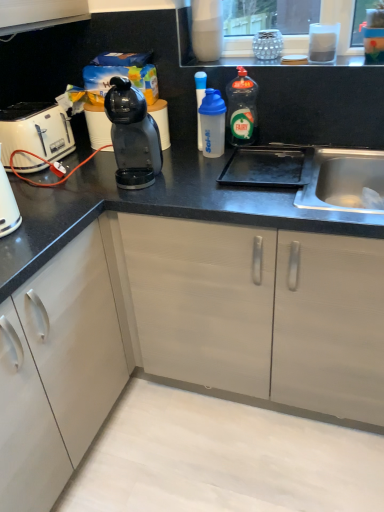
Question: Considering the positions of white plastic toaster at left and transparent plastic shaker at center, which is the first bottle in left-to-right order, in the image, is white plastic toaster at left wider or thinner than transparent plastic shaker at center, which is the first bottle in left-to-right order,?

Choices:
 (A) thin
 (B) wide

Answer: (B)

Question: Is white plastic toaster at left bigger or smaller than transparent plastic shaker at center, which is the first bottle in left-to-right order?

Choices:
 (A) small
 (B) big

Answer: (B)

Question: Which is nearer to the transparent plastic bottle at center, the first bottle from the right?

Choices:
 (A) white plastic shaker at center, the 2th bottle viewed from the right
 (B) white plastic toaster at left
 (C) transparent plastic shaker at center, which is the first bottle in left-to-right order
 (D) black plastic coffee machine at center

Answer: (A)

Question: Which of these objects is positioned farthest from the transparent plastic shaker at center, which is the first bottle in left-to-right order?

Choices:
 (A) white plastic toaster at left
 (B) white plastic shaker at center, the 2th bottle viewed from the right
 (C) black plastic coffee machine at center
 (D) transparent plastic bottle at center, the first bottle from the right

Answer: (A)